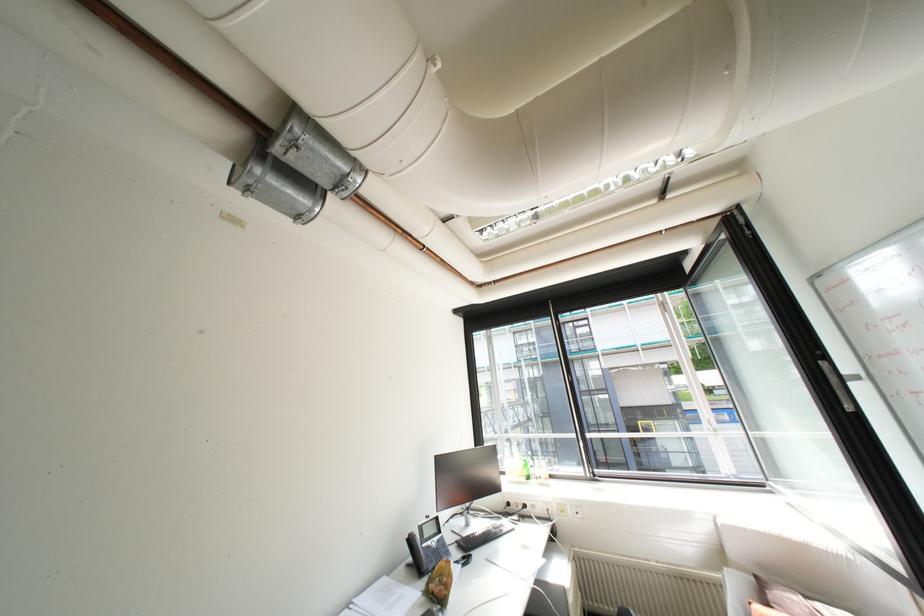
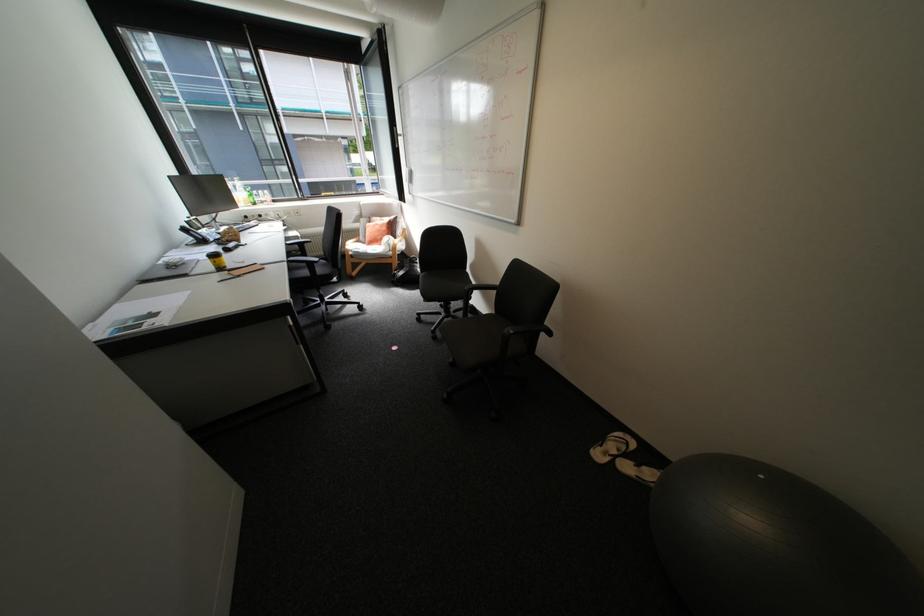
Locate, in the second image, the point that corresponds to (x=420, y=540) in the first image.

(195, 230)